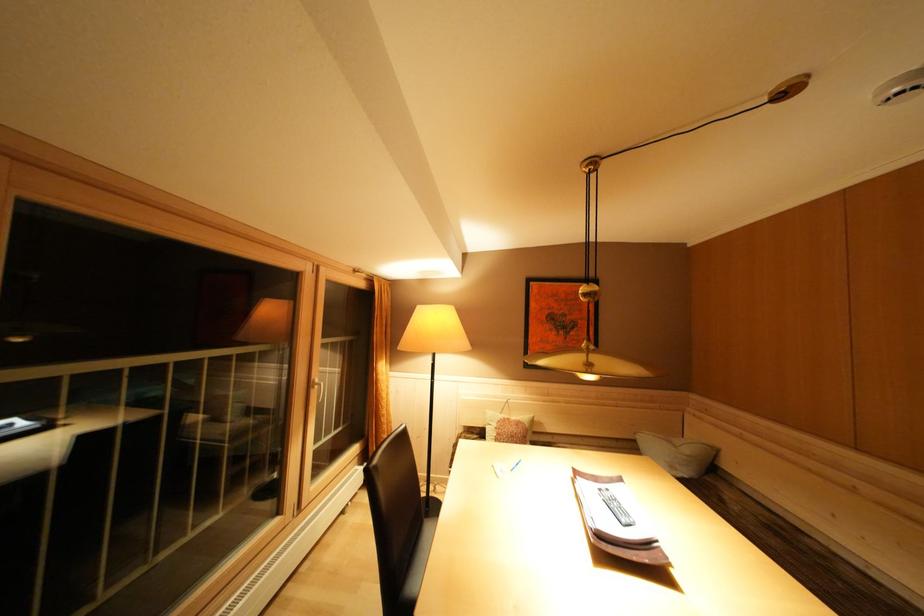
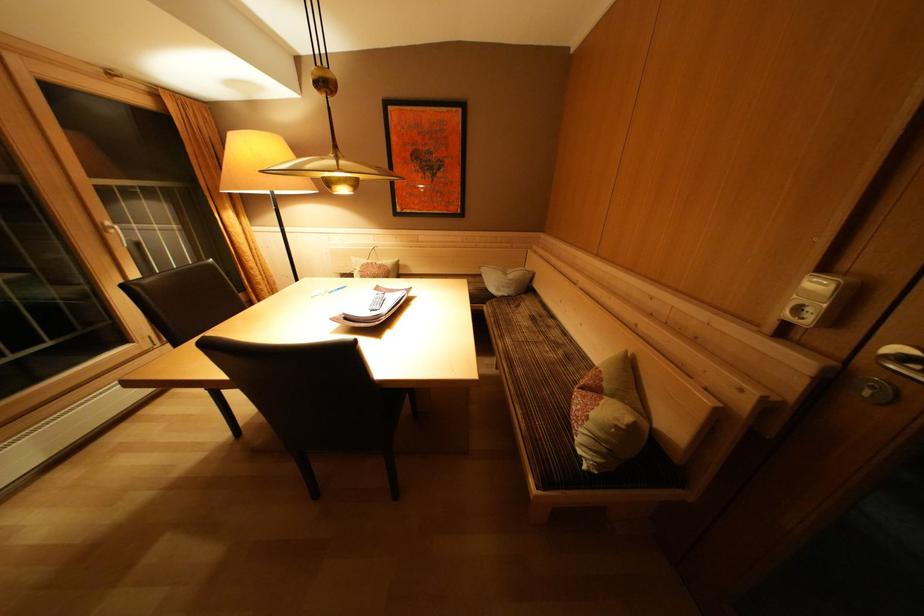
Find the pixel in the second image that matches [323,386] in the first image.

(116, 229)